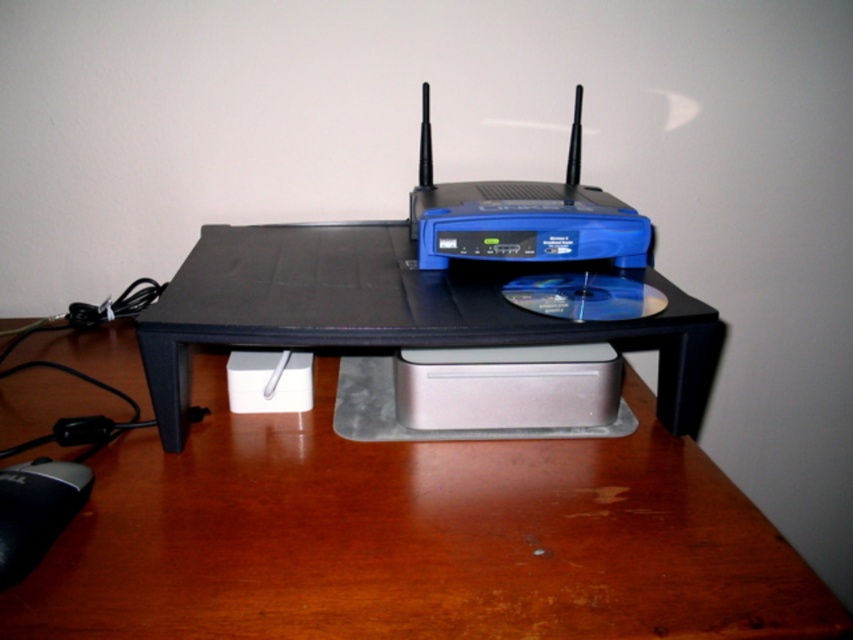
Question: Is black plastic table at center smaller than black rubber mouse at lower left?

Choices:
 (A) no
 (B) yes

Answer: (A)

Question: Which of the following is the farthest from the observer?

Choices:
 (A) black rubber mouse at lower left
 (B) black plastic table at center

Answer: (A)

Question: Does black plastic table at center appear over black rubber mouse at lower left?

Choices:
 (A) yes
 (B) no

Answer: (A)

Question: Which of the following is the farthest from the observer?

Choices:
 (A) black plastic table at center
 (B) black rubber mouse at lower left

Answer: (B)

Question: Which object is farther from the camera taking this photo?

Choices:
 (A) black rubber mouse at lower left
 (B) black plastic table at center

Answer: (A)

Question: Can you confirm if black plastic table at center is positioned below black rubber mouse at lower left?

Choices:
 (A) yes
 (B) no

Answer: (B)